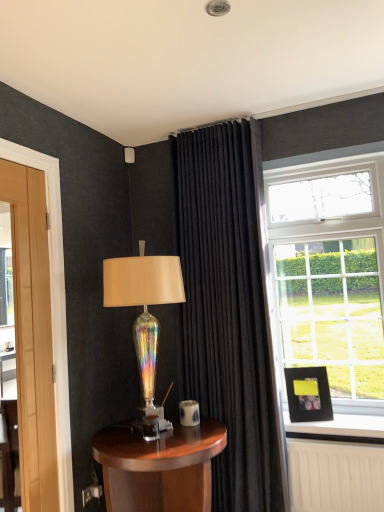
The width and height of the screenshot is (384, 512). In order to click on empty space that is ontop of black velvet curtain at center (from a real-world perspective) in this screenshot , I will do `click(223, 114)`.